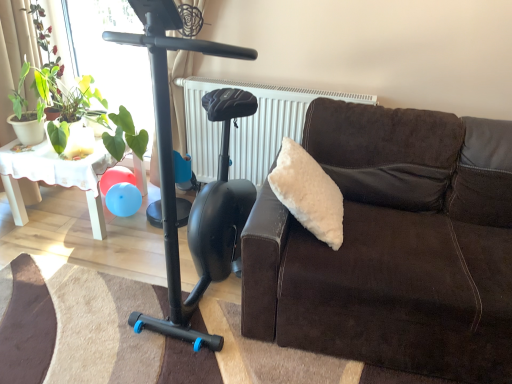
Locate an element on the screen. The width and height of the screenshot is (512, 384). vacant point to the left of black matte mobility scooter at left is located at coordinates (108, 258).